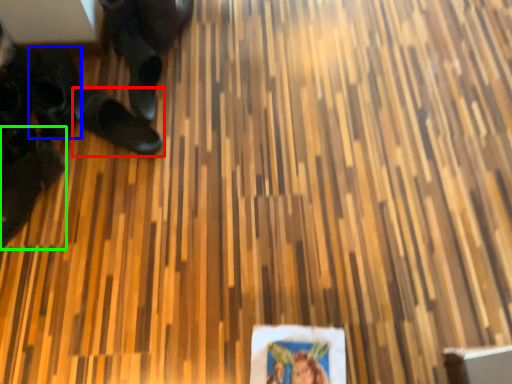
Question: Based on their relative distances, which object is nearer to footwear (highlighted by a red box)? Choose from footwear (highlighted by a blue box) and footwear (highlighted by a green box).

Choices:
 (A) footwear
 (B) footwear

Answer: (A)